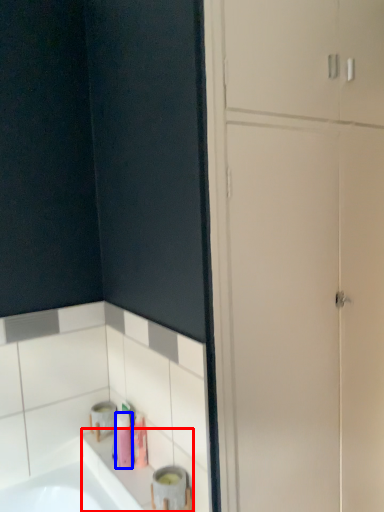
Question: Which point is closer to the camera, counter top (highlighted by a red box) or toiletry (highlighted by a blue box)?

Choices:
 (A) counter top
 (B) toiletry

Answer: (A)